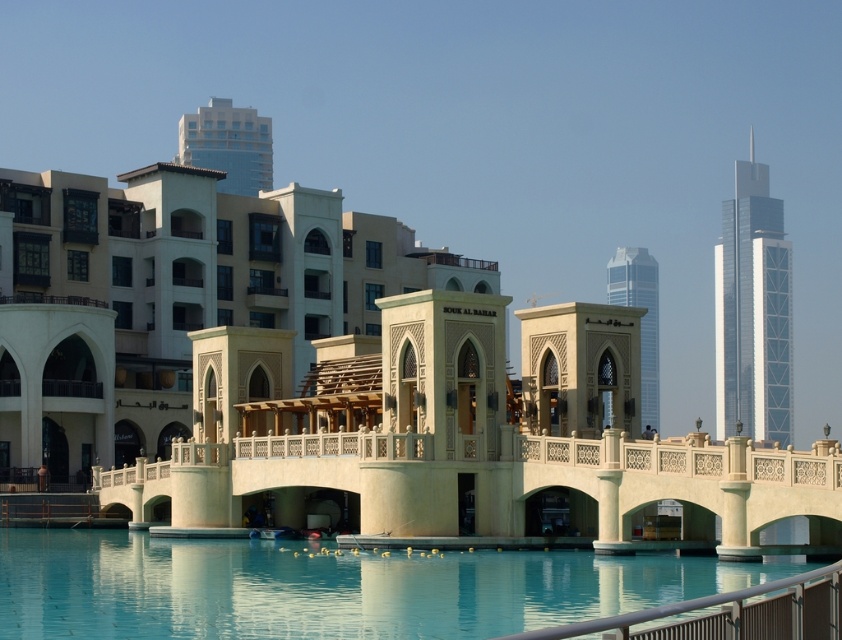
Question: Does shiny silver skyscraper at right appear over silver glass skyscraper at upper right?

Choices:
 (A) no
 (B) yes

Answer: (B)

Question: Can you confirm if smooth concrete pool at center is smaller than glassy blue skyscraper at upper center?

Choices:
 (A) yes
 (B) no

Answer: (A)

Question: In this image, where is glassy blue skyscraper at upper center located relative to silver glass skyscraper at upper right?

Choices:
 (A) above
 (B) below

Answer: (A)

Question: Which of the following is the farthest from the observer?

Choices:
 (A) (264, 157)
 (B) (717, 419)
 (C) (112, 572)

Answer: (B)

Question: Which object is closer to the camera taking this photo?

Choices:
 (A) shiny silver skyscraper at right
 (B) smooth concrete pool at center

Answer: (B)

Question: Which point is closer to the camera taking this photo?

Choices:
 (A) (206, 168)
 (B) (613, 301)

Answer: (B)